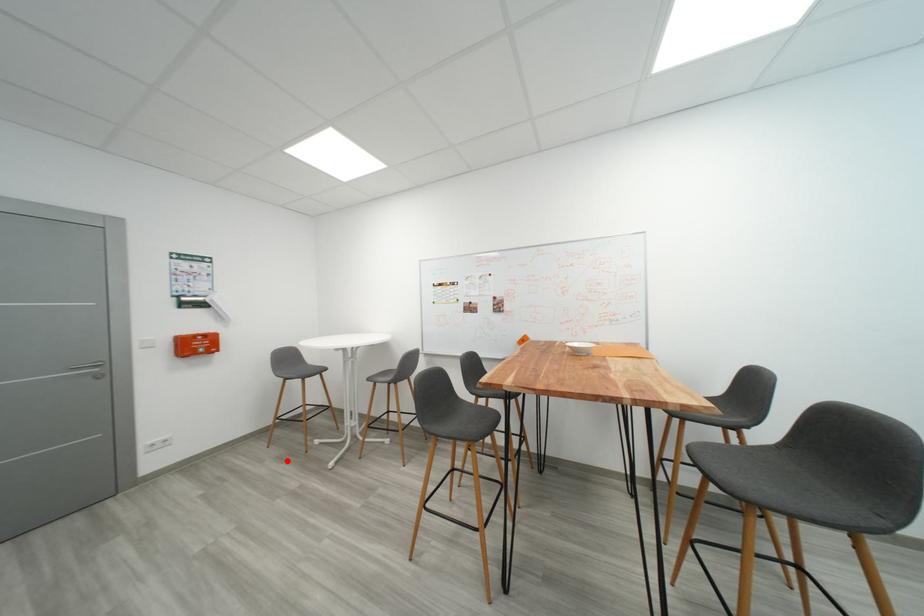
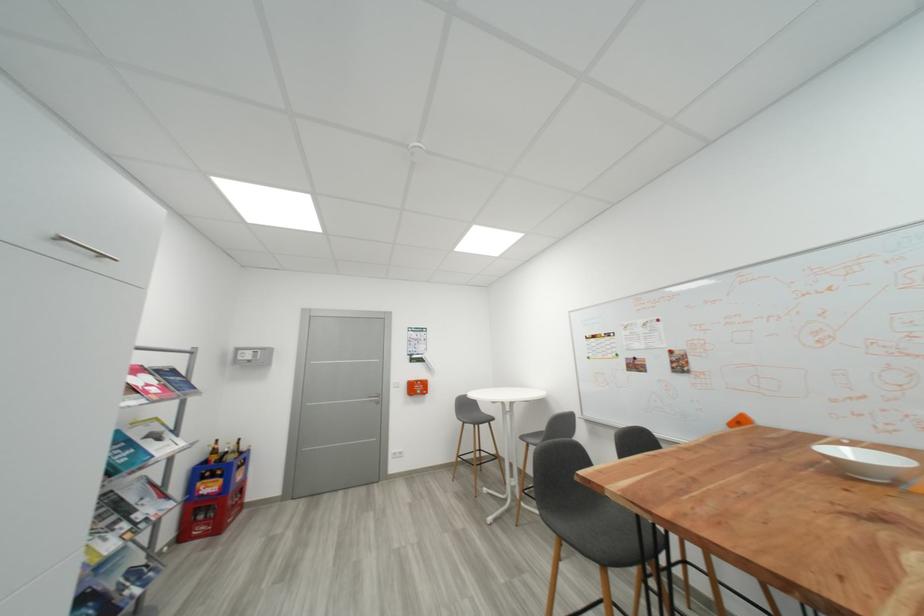
Question: I am providing you with two images of the same scene from different viewpoints. A red point is shown in image1. For the corresponding object point in image2, is it positioned nearer or farther from the camera?

Choices:
 (A) Nearer
 (B) Farther

Answer: (B)